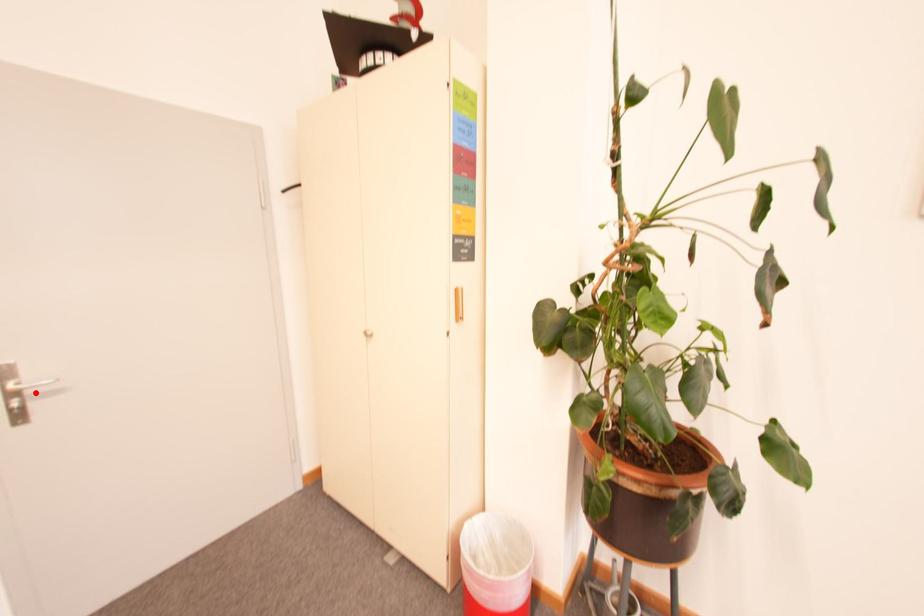
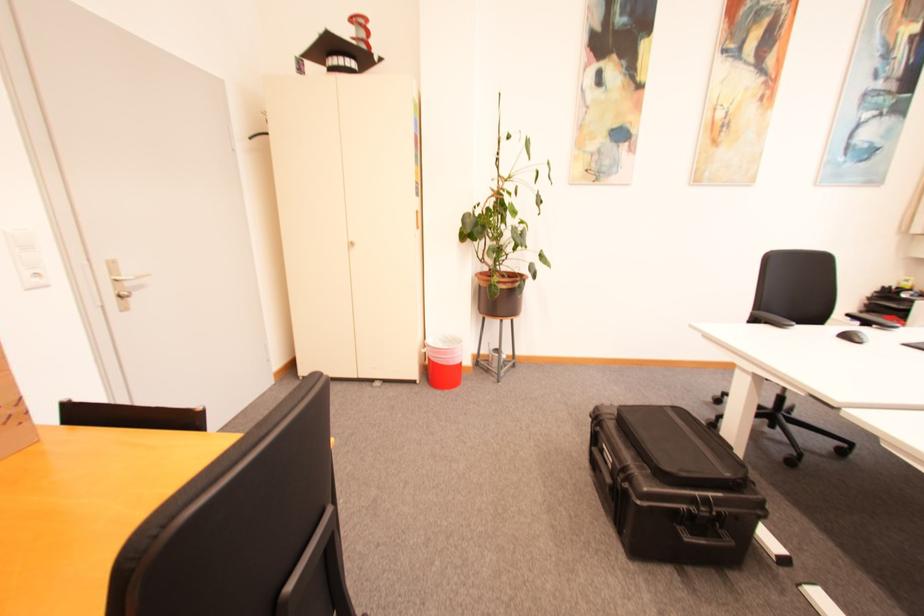
In the second image, find the point that corresponds to the highlighted location in the first image.

(134, 285)